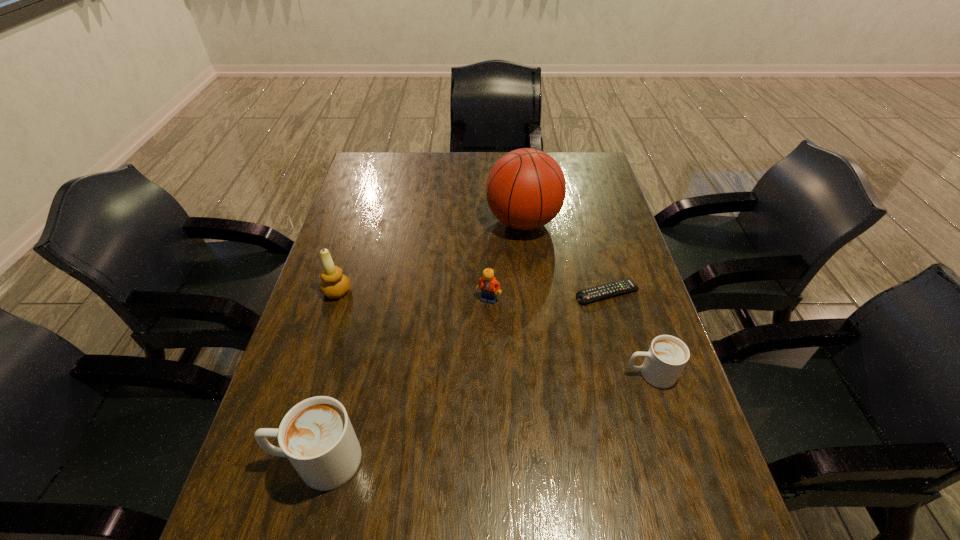
Where is `free spot between the tallest object and the shortest object`? This screenshot has height=540, width=960. free spot between the tallest object and the shortest object is located at coordinates (565, 258).

Locate an element on the screen. free spot between the shortest object and the candle_holder is located at coordinates (472, 293).

Find the location of `free space between the nearest object and the right cappuccino`. free space between the nearest object and the right cappuccino is located at coordinates (484, 417).

I want to click on vacant region between the Lego and the remote control, so click(x=548, y=296).

Identify the location of vacant area that lies between the tallest object and the nearer cappuccino. (420, 341).

Identify the location of free space between the Lego and the nearer cappuccino. (403, 380).

In order to click on vacant point located between the Lego and the candle_holder in this screenshot , I will do `click(413, 295)`.

The width and height of the screenshot is (960, 540). Find the location of `free spot between the remote control and the candle_holder`. free spot between the remote control and the candle_holder is located at coordinates (472, 293).

Identify the location of object that is the third closest to the tallest object. This screenshot has height=540, width=960. (334, 284).

Locate which object is the fifth closest to the fifth farthest object. Please provide its 2D coordinates. Your answer should be formatted as a tuple, i.e. [(x, y)], where the tuple contains the x and y coordinates of a point satisfying the conditions above.

[(334, 284)]